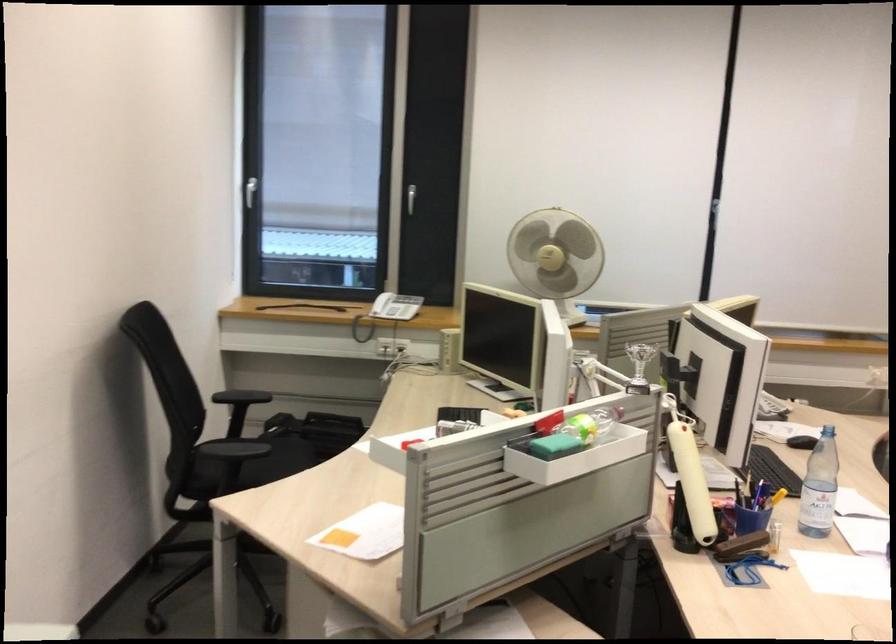
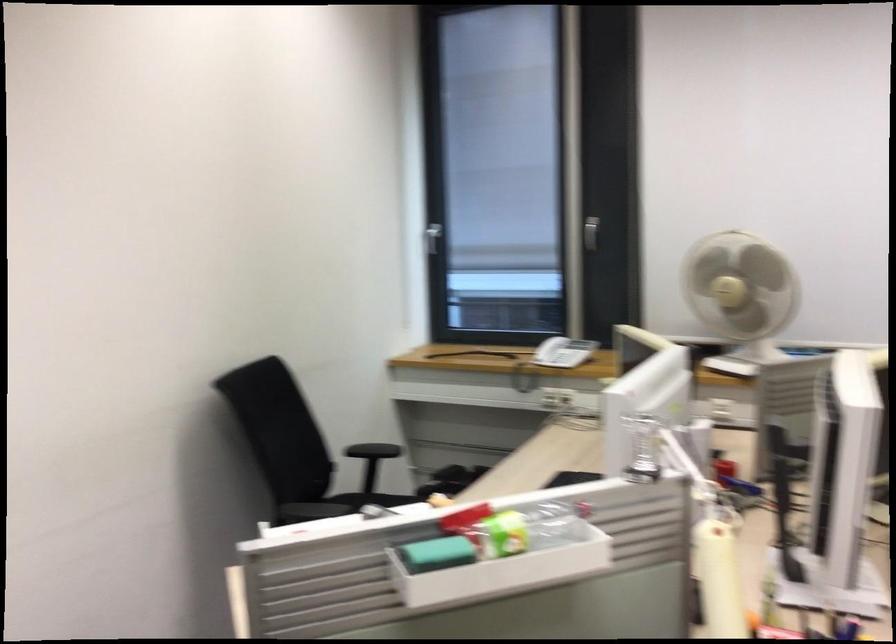
Question: The camera is either moving clockwise (left) or counter-clockwise (right) around the object. The first image is from the beginning of the video and the second image is from the end. Is the camera moving left or right when shooting the video?

Choices:
 (A) Left
 (B) Right

Answer: (B)